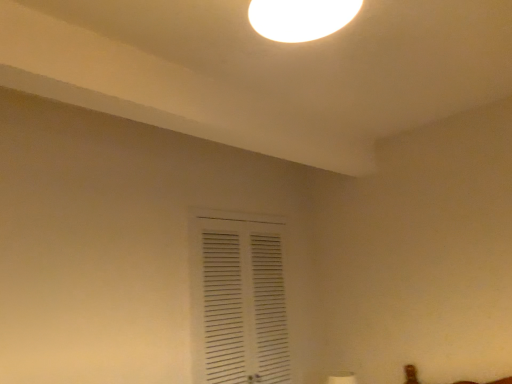
The image size is (512, 384). Describe the element at coordinates (238, 299) in the screenshot. I see `white matte vent at center` at that location.

What are the coordinates of `white matte vent at center` in the screenshot? It's located at (238, 299).

Measure the distance between point (210, 271) and camera.

They are 2.42 meters apart.

What is the approximate height of white glossy light fixture at upper center?

white glossy light fixture at upper center is 6.43 inches tall.

Locate an element on the screen. white glossy light fixture at upper center is located at coordinates (300, 18).

Image resolution: width=512 pixels, height=384 pixels. Describe the element at coordinates (300, 18) in the screenshot. I see `white glossy light fixture at upper center` at that location.

This screenshot has width=512, height=384. What are the coordinates of `white matte vent at center` in the screenshot? It's located at (238, 299).

Is white glossy light fixture at upper center to the left of white matte vent at center from the viewer's perspective?

Incorrect, white glossy light fixture at upper center is not on the left side of white matte vent at center.

In the image, is white glossy light fixture at upper center positioned in front of or behind white matte vent at center?

white glossy light fixture at upper center is positioned closer to the viewer than white matte vent at center.

Does point (343, 22) lie in front of point (279, 305)?

That is True.

From the image's perspective, is white glossy light fixture at upper center beneath white matte vent at center?

No, from the image's perspective, white glossy light fixture at upper center is not below white matte vent at center.

From a real-world perspective, is white glossy light fixture at upper center on white matte vent at center?

Correct, in the physical world, white glossy light fixture at upper center is higher than white matte vent at center.

Is white glossy light fixture at upper center wider or thinner than white matte vent at center?

In the image, white glossy light fixture at upper center appears to be wider than white matte vent at center.

Does white glossy light fixture at upper center have a greater height compared to white matte vent at center?

No, white glossy light fixture at upper center is not taller than white matte vent at center.

Who is bigger, white glossy light fixture at upper center or white matte vent at center?

white matte vent at center is bigger.

Is white glossy light fixture at upper center not within white matte vent at center?

Yes, white glossy light fixture at upper center is located beyond the bounds of white matte vent at center.

From the picture: Is white glossy light fixture at upper center next to white matte vent at center?

There is a gap between white glossy light fixture at upper center and white matte vent at center.

Is white glossy light fixture at upper center aimed at white matte vent at center?

No, white glossy light fixture at upper center is not oriented towards white matte vent at center.

Where is `lamp in front of the white matte vent at center`? The height and width of the screenshot is (384, 512). lamp in front of the white matte vent at center is located at coordinates (300, 18).

Can you confirm if white matte vent at center is positioned to the right of white glossy light fixture at upper center?

Incorrect, white matte vent at center is not on the right side of white glossy light fixture at upper center.

Which is in front, white matte vent at center or white glossy light fixture at upper center?

white glossy light fixture at upper center is in front.

Is point (218, 371) farther from camera compared to point (249, 5)?

Yes, it is behind point (249, 5).

From the image's perspective, between white matte vent at center and white glossy light fixture at upper center, who is located below?

white matte vent at center appears lower in the image.

From a real-world perspective, is white matte vent at center beneath white glossy light fixture at upper center?

Indeed, from a real-world perspective, white matte vent at center is positioned beneath white glossy light fixture at upper center.

Between white matte vent at center and white glossy light fixture at upper center, which one has larger width?

white glossy light fixture at upper center.

Can you confirm if white matte vent at center is shorter than white glossy light fixture at upper center?

No, white matte vent at center is not shorter than white glossy light fixture at upper center.

Looking at the image, does white matte vent at center seem bigger or smaller compared to white glossy light fixture at upper center?

Considering their sizes, white matte vent at center takes up more space than white glossy light fixture at upper center.

Can we say white matte vent at center lies outside white glossy light fixture at upper center?

Yes.

Is white matte vent at center not near white glossy light fixture at upper center?

white matte vent at center is far away from white glossy light fixture at upper center.

Is white matte vent at center turned away from white glossy light fixture at upper center?

No.

At what (x,y) coordinates should I click in order to perform the action: click on window that is under the white glossy light fixture at upper center (from a real-world perspective). Please return your answer as a coordinate pair (x, y). Looking at the image, I should click on (238, 299).

Find the location of a particular element. The width and height of the screenshot is (512, 384). window beneath the white glossy light fixture at upper center (from a real-world perspective) is located at coordinates pos(238,299).

Where is `lamp located above the white matte vent at center (from the image's perspective)`? The height and width of the screenshot is (384, 512). lamp located above the white matte vent at center (from the image's perspective) is located at coordinates (300, 18).